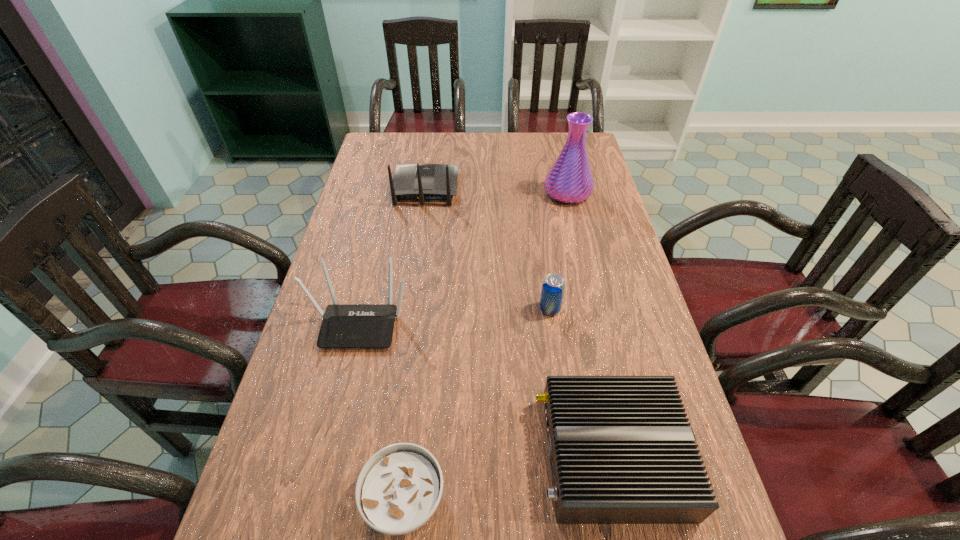
In the image, there is a desktop. At what (x,y) coordinates should I click in order to perform the action: click on free region at the far left corner. Please return your answer as a coordinate pair (x, y). The height and width of the screenshot is (540, 960). Looking at the image, I should click on (394, 136).

I want to click on free space between the farthest router and the nearest router, so click(518, 322).

I want to click on vacant area between the second nearest router and the nearest router, so click(x=487, y=389).

Locate an element on the screen. free point between the beer can and the vase is located at coordinates (559, 251).

The image size is (960, 540). I want to click on free space between the tallest object and the beer can, so click(x=559, y=251).

This screenshot has height=540, width=960. I want to click on free space between the vase and the beer can, so click(559, 251).

Identify the location of vacant region between the tallest object and the farthest router. The image size is (960, 540). (496, 191).

Locate which object ranks fourth in proximity to the beer can. Please provide its 2D coordinates. Your answer should be formatted as a tuple, i.e. [(x, y)], where the tuple contains the x and y coordinates of a point satisfying the conditions above.

[(399, 488)]

Choose which object is the fifth nearest neighbor to the farthest router. Please provide its 2D coordinates. Your answer should be formatted as a tuple, i.e. [(x, y)], where the tuple contains the x and y coordinates of a point satisfying the conditions above.

[(399, 488)]

Choose which router is the nearest neighbor to the second farthest router. Please provide its 2D coordinates. Your answer should be formatted as a tuple, i.e. [(x, y)], where the tuple contains the x and y coordinates of a point satisfying the conditions above.

[(621, 449)]